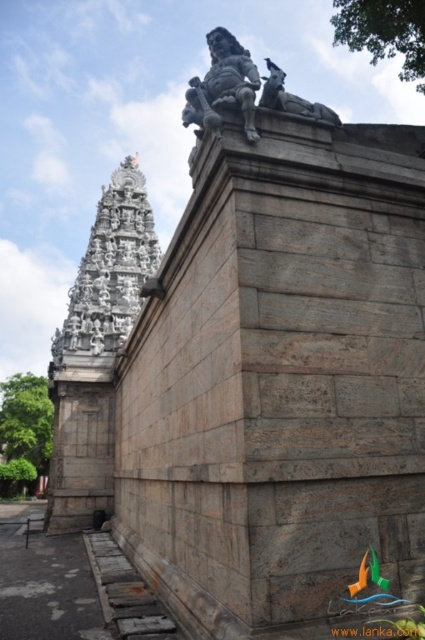
Question: Considering the real-world distances, which object is farthest from the slate gray stone statue at upper center?

Choices:
 (A) white stone temple at upper left
 (B) gray stone lion at upper center

Answer: (A)

Question: Can you confirm if white stone temple at upper left is bigger than slate gray stone statue at upper center?

Choices:
 (A) no
 (B) yes

Answer: (B)

Question: Is the position of white stone temple at upper left less distant than that of gray stone lion at upper center?

Choices:
 (A) yes
 (B) no

Answer: (B)

Question: Does slate gray stone statue at upper center appear under gray stone lion at upper center?

Choices:
 (A) no
 (B) yes

Answer: (B)

Question: Which object appears closest to the camera in this image?

Choices:
 (A) gray stone lion at upper center
 (B) white stone temple at upper left

Answer: (A)

Question: Which object appears closest to the camera in this image?

Choices:
 (A) gray stone lion at upper center
 (B) slate gray stone statue at upper center

Answer: (B)